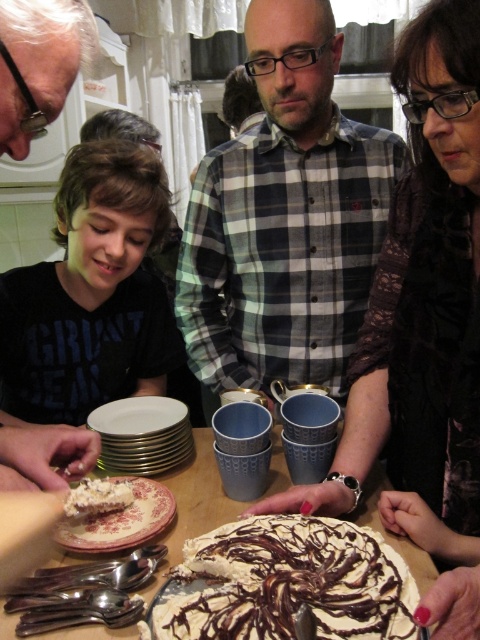
Does point (242, 634) come farther from viewer compared to point (372, 502)?

No, (242, 634) is in front of (372, 502).

From the picture: Can you confirm if chocolate frosted cake at center is bigger than white ceramic table at center?

No, chocolate frosted cake at center is not bigger than white ceramic table at center.

Is point (350, 589) closer to camera compared to point (416, 566)?

That is True.

The width and height of the screenshot is (480, 640). I want to click on chocolate frosted cake at center, so click(x=290, y=582).

Can you confirm if white ceramic table at center is positioned above white creamy frosting at lower left?

No, white ceramic table at center is not above white creamy frosting at lower left.

Describe the element at coordinates (193, 502) in the screenshot. I see `white ceramic table at center` at that location.

Which is behind, point (213, 492) or point (95, 483)?

Point (213, 492)

Locate an element on the screen. white ceramic table at center is located at coordinates (193, 502).

Can you confirm if matte black shirt at center is taller than white ceramic table at center?

Incorrect, matte black shirt at center's height is not larger of white ceramic table at center's.

This screenshot has height=640, width=480. Find the location of `matte black shirt at center`. matte black shirt at center is located at coordinates (38, 65).

This screenshot has width=480, height=640. Identify the location of matte black shirt at center. (38, 65).